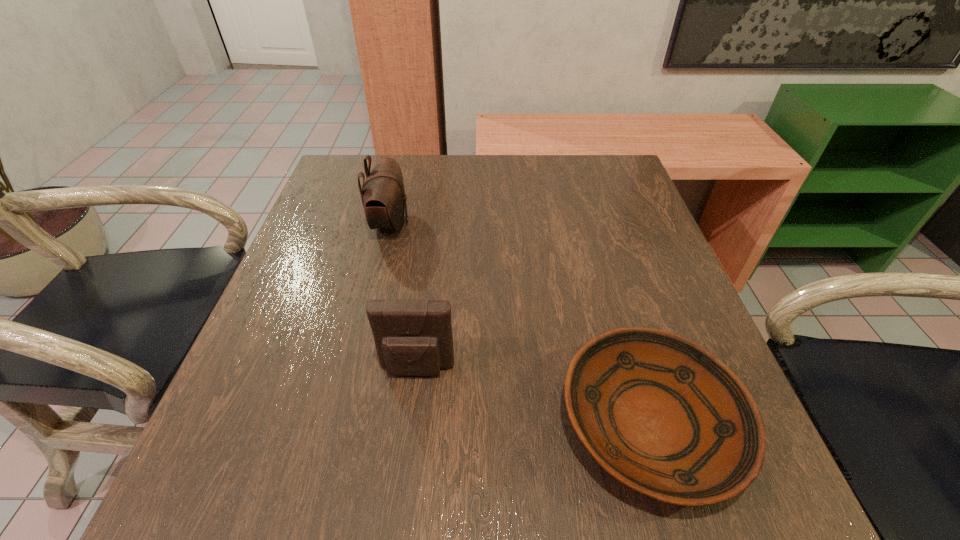
Where is `blank space that satisfies the following two spatial constraints: 1. with an open flap on the rightmost object; 2. on the left side of the nearer pouch`? This screenshot has width=960, height=540. blank space that satisfies the following two spatial constraints: 1. with an open flap on the rightmost object; 2. on the left side of the nearer pouch is located at coordinates (411, 423).